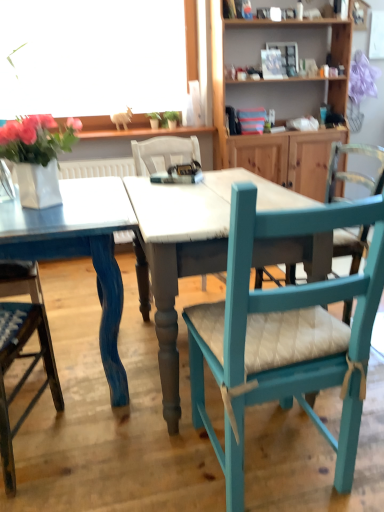
Question: Is blue painted wood table at center closer to camera compared to wooden cabinet at upper right?

Choices:
 (A) no
 (B) yes

Answer: (B)

Question: Does blue painted wood table at center have a greater width compared to wooden cabinet at upper right?

Choices:
 (A) yes
 (B) no

Answer: (A)

Question: Is blue painted wood table at center oriented away from wooden cabinet at upper right?

Choices:
 (A) no
 (B) yes

Answer: (A)

Question: Is blue painted wood table at center shorter than wooden cabinet at upper right?

Choices:
 (A) no
 (B) yes

Answer: (B)

Question: Would you say blue painted wood table at center is a long distance from wooden cabinet at upper right?

Choices:
 (A) yes
 (B) no

Answer: (A)

Question: Could you tell me if blue painted wood table at center is facing wooden cabinet at upper right?

Choices:
 (A) no
 (B) yes

Answer: (A)

Question: Is teal painted wood chair at right, arranged as the first chair when viewed from the right, wider than white glossy vase at upper left?

Choices:
 (A) yes
 (B) no

Answer: (A)

Question: Does teal painted wood chair at right, arranged as the first chair when viewed from the right, have a greater height compared to white glossy vase at upper left?

Choices:
 (A) yes
 (B) no

Answer: (A)

Question: Is teal painted wood chair at right, arranged as the first chair when viewed from the right, shorter than white glossy vase at upper left?

Choices:
 (A) yes
 (B) no

Answer: (B)

Question: Is teal painted wood chair at right, arranged as the first chair when viewed from the right, smaller than white glossy vase at upper left?

Choices:
 (A) yes
 (B) no

Answer: (B)

Question: Is the position of teal painted wood chair at right, acting as the 2th chair starting from the left, less distant than that of white glossy vase at upper left?

Choices:
 (A) yes
 (B) no

Answer: (A)

Question: From the image's perspective, would you say teal painted wood chair at right, acting as the 2th chair starting from the left, is shown under white glossy vase at upper left?

Choices:
 (A) no
 (B) yes

Answer: (B)

Question: Does white glossy vase at upper left appear on the left side of blue painted wood table at center?

Choices:
 (A) yes
 (B) no

Answer: (A)